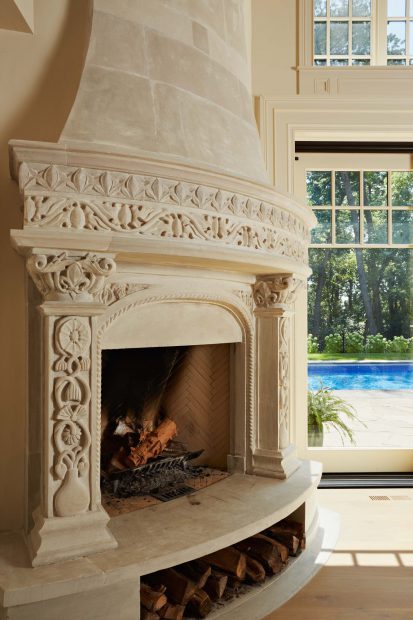
This screenshot has width=413, height=620. I want to click on smoke stack above fireplace, so click(x=234, y=17), click(x=108, y=32), click(x=242, y=161), click(x=111, y=131).